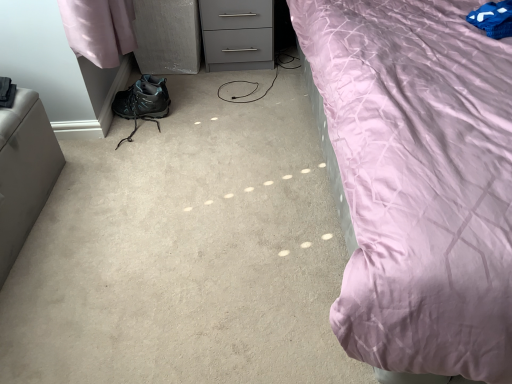
I want to click on free spot in front of gray matte chest of drawers at upper center, so click(x=234, y=87).